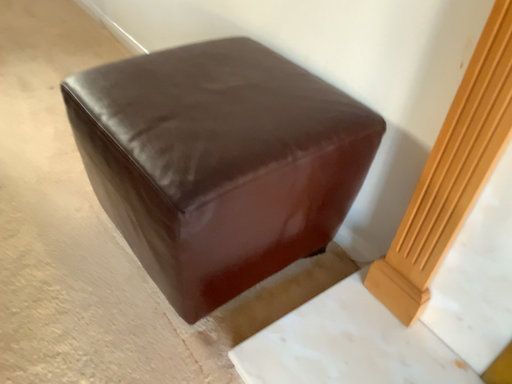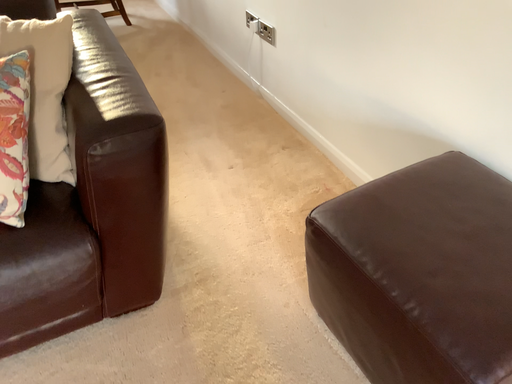
Question: How did the camera likely rotate when shooting the video?

Choices:
 (A) rotated right
 (B) rotated left

Answer: (B)